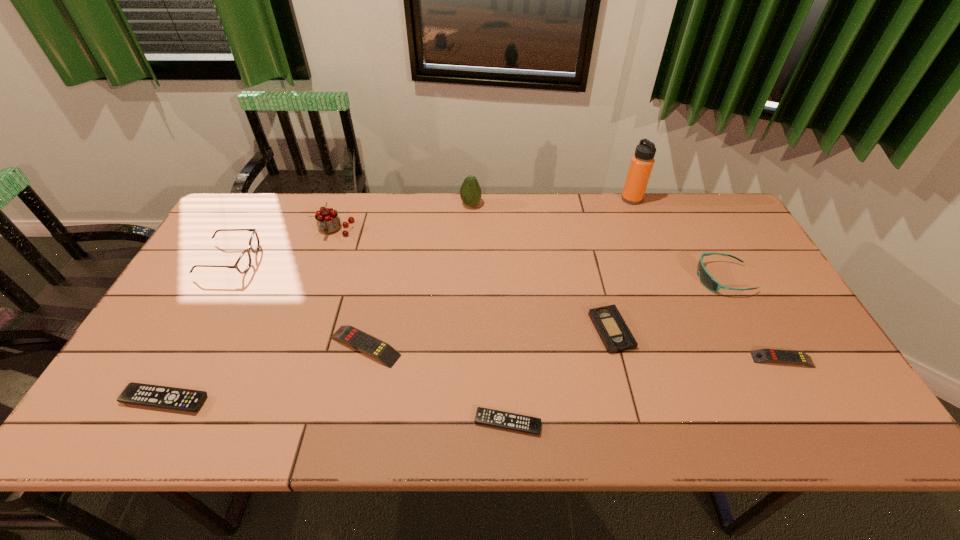
In order to click on cherry located at the far edge in this screenshot , I will do `click(328, 221)`.

Image resolution: width=960 pixels, height=540 pixels. Identify the location of spectacles at the left edge. (243, 263).

This screenshot has height=540, width=960. Find the location of `remote control situated at the left edge`. remote control situated at the left edge is located at coordinates (157, 396).

What are the coordinates of `sunglasses that is at the right edge` in the screenshot? It's located at (706, 279).

Locate an element on the screen. remote control that is at the right edge is located at coordinates (762, 355).

Where is `object that is at the near left corner`? object that is at the near left corner is located at coordinates (157, 396).

Identify the location of vacant space at the far edge of the desktop. This screenshot has height=540, width=960. (379, 221).

At what (x,y) coordinates should I click in order to perform the action: click on vacant space at the near edge of the desktop. Please return your answer as a coordinate pair (x, y). This screenshot has height=540, width=960. Looking at the image, I should click on (192, 423).

The width and height of the screenshot is (960, 540). I want to click on vacant space at the left edge, so click(x=191, y=342).

The width and height of the screenshot is (960, 540). Find the location of `blank space at the right edge`. blank space at the right edge is located at coordinates (760, 302).